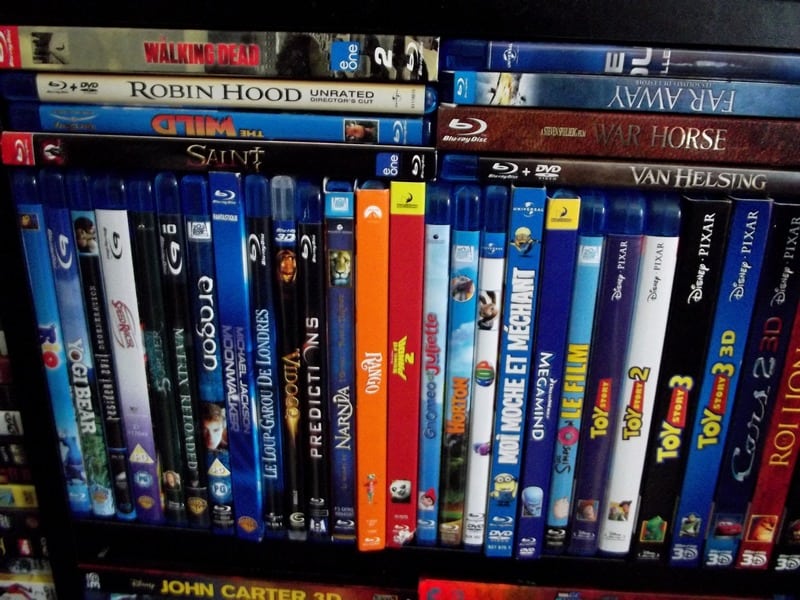
At what (x,y) coordinates should I click in order to perform the action: click on horizontal dvd's on top (not counting dvd set's). Please return your answer as a coordinate pair (x, y). This screenshot has height=600, width=800. Looking at the image, I should click on (604, 177), (600, 93), (589, 58), (372, 101), (317, 130), (286, 155).